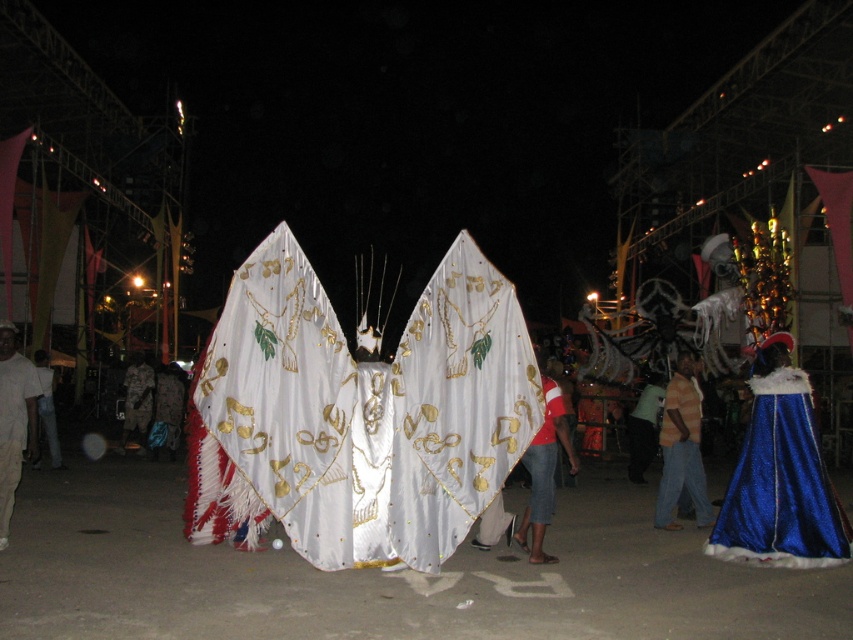
Question: Can you confirm if white cotton shirt at left is thinner than camouflage fabric pants at lower left?

Choices:
 (A) yes
 (B) no

Answer: (A)

Question: Can you confirm if blue glittering cape at center is wider than camouflage fabric pants at lower left?

Choices:
 (A) no
 (B) yes

Answer: (A)

Question: Which point is farther from the camera taking this photo?

Choices:
 (A) click(x=49, y=384)
 (B) click(x=567, y=426)

Answer: (A)

Question: Which point appears farthest from the camera in this image?

Choices:
 (A) (637, 481)
 (B) (132, 392)
 (C) (444, 358)

Answer: (B)

Question: Among these points, which one is farthest from the camera?

Choices:
 (A) (141, 360)
 (B) (51, 412)

Answer: (A)

Question: Is white satin wings at center closer to the viewer compared to camouflage fabric at center?

Choices:
 (A) yes
 (B) no

Answer: (A)